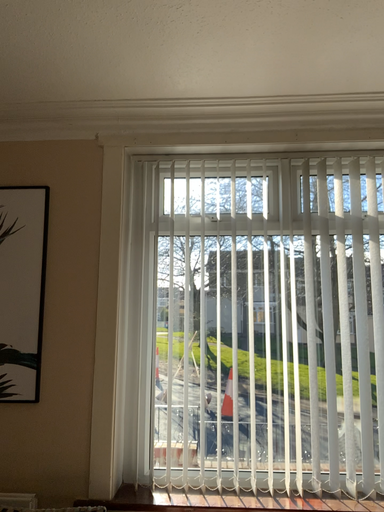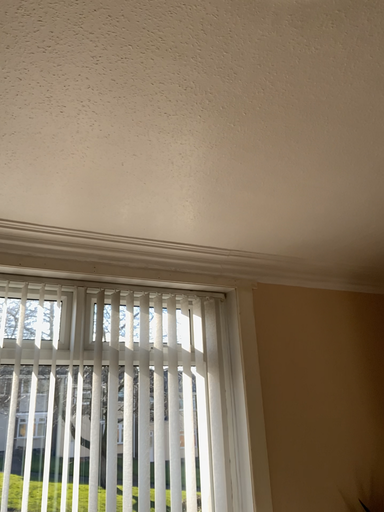
Question: Which way did the camera rotate in the video?

Choices:
 (A) rotated downward
 (B) rotated upward

Answer: (B)